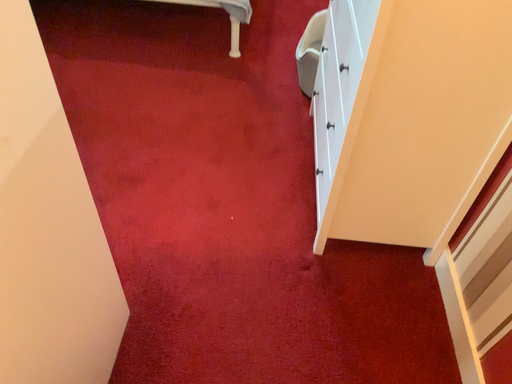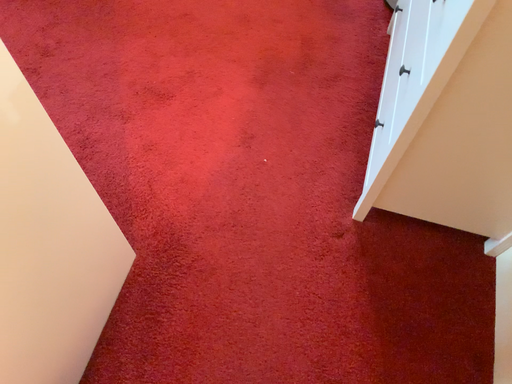
Question: How did the camera likely rotate when shooting the video?

Choices:
 (A) rotated right
 (B) rotated left

Answer: (B)